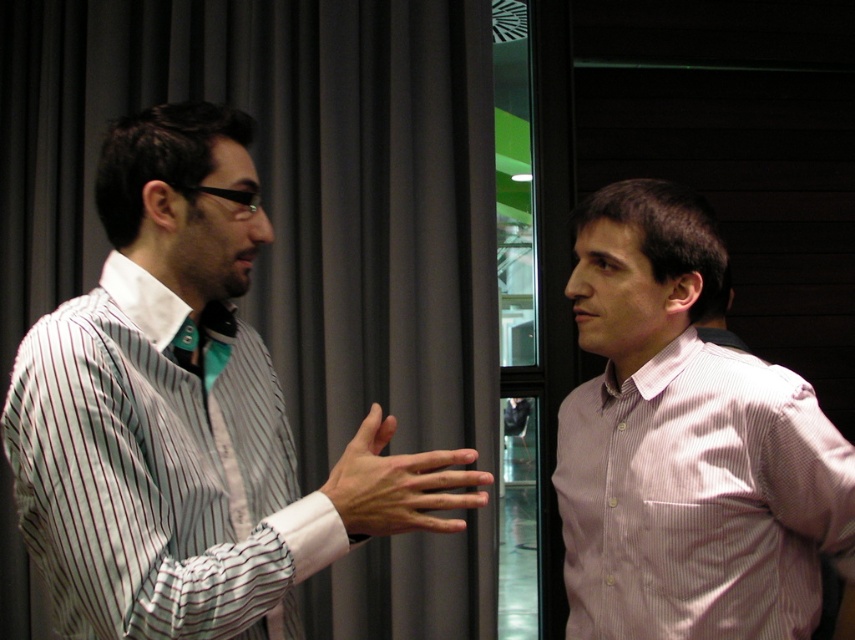
Can you confirm if striped cotton shirt at left is wider than pink striped shirt at right?

Correct, the width of striped cotton shirt at left exceeds that of pink striped shirt at right.

Who is positioned more to the right, striped cotton shirt at left or pink striped shirt at right?

From the viewer's perspective, pink striped shirt at right appears more on the right side.

Is point (376, 420) more distant than point (688, 300)?

No, it is in front of (688, 300).

The height and width of the screenshot is (640, 855). Identify the location of striped cotton shirt at left. (187, 416).

Looking at this image, measure the distance between striped cotton shirt at left and transparent glass door at center.

striped cotton shirt at left is 1.78 meters from transparent glass door at center.

Does point (211, 380) come closer to viewer compared to point (502, 611)?

Yes.

Where is `striped cotton shirt at left`? The image size is (855, 640). striped cotton shirt at left is located at coordinates (187, 416).

Is pink striped shirt at right shorter than transparent glass door at center?

Yes, pink striped shirt at right is shorter than transparent glass door at center.

Between pink striped shirt at right and transparent glass door at center, which one is positioned higher?

transparent glass door at center is higher up.

You are a GUI agent. You are given a task and a screenshot of the screen. Output one action in this format:
    pyautogui.click(x=<x>, y=<y>)
    Task: Click on the pink striped shirt at right
    The height and width of the screenshot is (640, 855).
    Given the screenshot: What is the action you would take?
    pyautogui.click(x=687, y=445)

In order to click on pink striped shirt at right in this screenshot , I will do `click(687, 445)`.